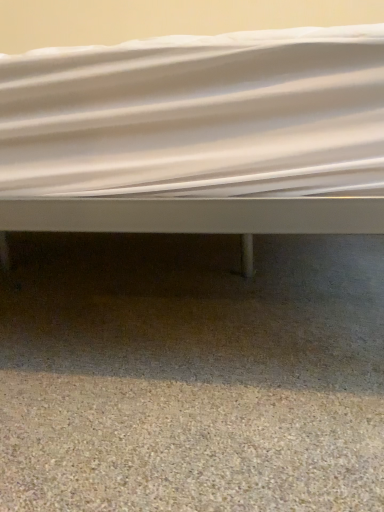
Image resolution: width=384 pixels, height=512 pixels. Describe the element at coordinates (197, 135) in the screenshot. I see `white fabric bed at center` at that location.

Where is `white fabric bed at center`? This screenshot has height=512, width=384. white fabric bed at center is located at coordinates (197, 135).

Where is `white fabric bed at center`? This screenshot has width=384, height=512. white fabric bed at center is located at coordinates (197, 135).